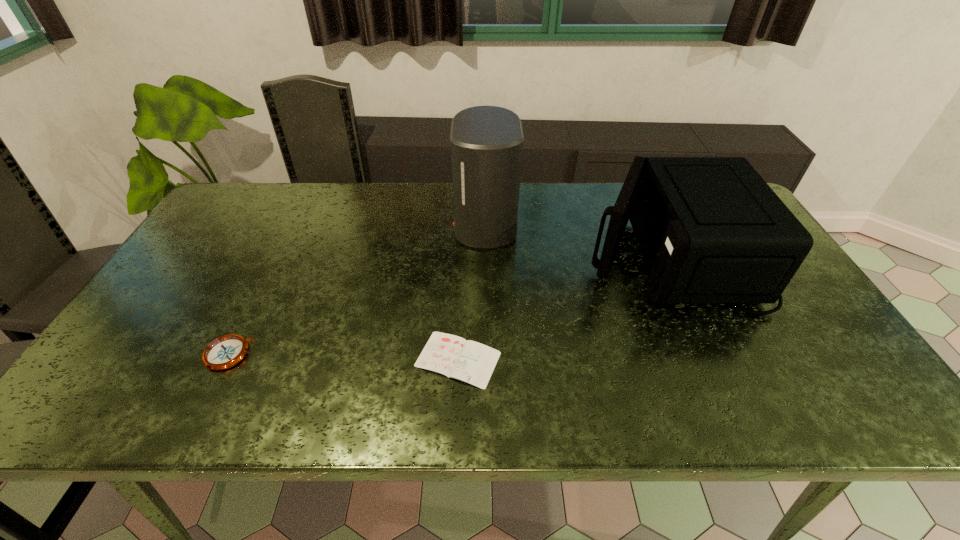
This screenshot has height=540, width=960. I want to click on free area in between the third tallest object and the shortest object, so click(343, 357).

Where is `blank region between the shortest object and the third shortest object`? Image resolution: width=960 pixels, height=540 pixels. blank region between the shortest object and the third shortest object is located at coordinates (563, 306).

You are a GUI agent. You are given a task and a screenshot of the screen. Output one action in this format:
    pyautogui.click(x=<x>, y=<y>)
    Task: Click on the unoccupied position between the second shortest object and the shortest object
    
    Given the screenshot: What is the action you would take?
    pyautogui.click(x=343, y=357)

Locate which object ranks in proximity to the second tallest object. Please provide its 2D coordinates. Your answer should be formatted as a tuple, i.e. [(x, y)], where the tuple contains the x and y coordinates of a point satisfying the conditions above.

[(486, 142)]

Where is `object that is the third closest to the tallest object`? The width and height of the screenshot is (960, 540). object that is the third closest to the tallest object is located at coordinates (226, 351).

Where is `vacant space that satisfies the following two spatial constraints: 1. on the front side of the diary; 2. on the right side of the third tallest object`? vacant space that satisfies the following two spatial constraints: 1. on the front side of the diary; 2. on the right side of the third tallest object is located at coordinates (226, 359).